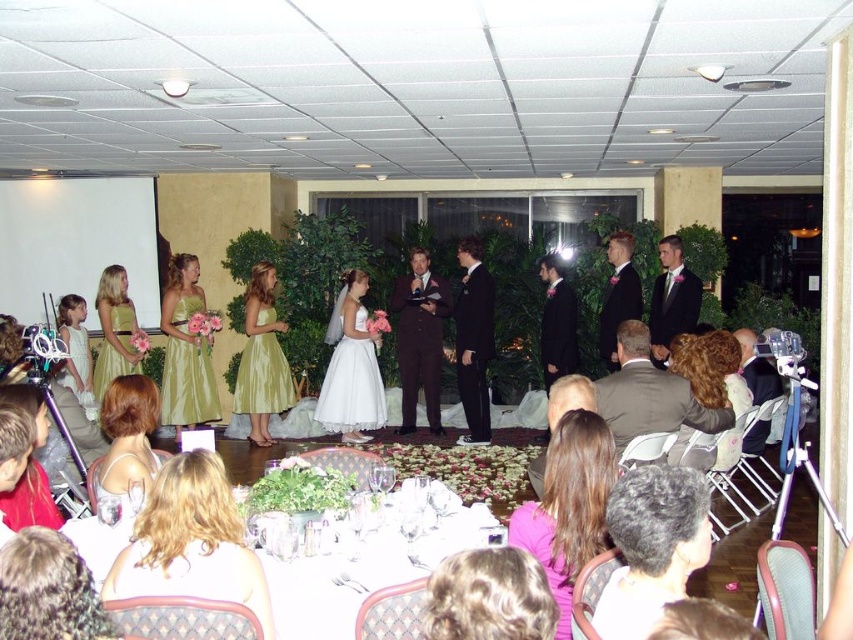
During the wedding ceremony, you notice two prominent outfits at the center stage. The shiny dark suit at center and the gold satin dress at center. Which of these two outfits has a wider silhouette?

The gold satin dress at center has a wider silhouette than the shiny dark suit at center.

During the wedding ceremony, the bride in the white satin dress at center and the groom in the dark suit at center are standing on the stage. From the perspective of someone facing the stage, which side is the bride located relative to the groom?

The white satin dress at center is to the left of dark suit at center, so the bride in the white satin dress at center is positioned to the left side of the groom in the dark suit at center from the perspective of someone facing the stage.